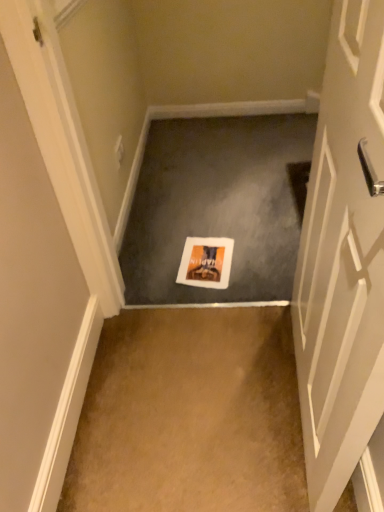
Question: Considering the positions of brown carpet at center, which is counted as the 2th concrete, starting from the top, and white paper at center, which ranks as the 1th concrete in top-to-bottom order, in the image, is brown carpet at center, which is counted as the 2th concrete, starting from the top, wider or thinner than white paper at center, which ranks as the 1th concrete in top-to-bottom order,?

Choices:
 (A) thin
 (B) wide

Answer: (A)

Question: From the image's perspective, is brown carpet at center, which is counted as the first concrete, starting from the front, above or below white paper at center, which appears as the 1th concrete when viewed from the back?

Choices:
 (A) below
 (B) above

Answer: (A)

Question: Based on their relative distances, which object is farther from the white glossy door at center right?

Choices:
 (A) white paper at center, the 2th concrete in the front-to-back sequence
 (B) brown carpet at center, positioned as the 2th concrete in back-to-front order
 (C) orange matte postcard at center

Answer: (A)

Question: Estimate the real-world distances between objects in this image. Which object is closer to the white glossy door at center right?

Choices:
 (A) orange matte postcard at center
 (B) white paper at center, the 2th concrete in the front-to-back sequence
 (C) brown carpet at center, positioned as the 2th concrete in back-to-front order

Answer: (C)